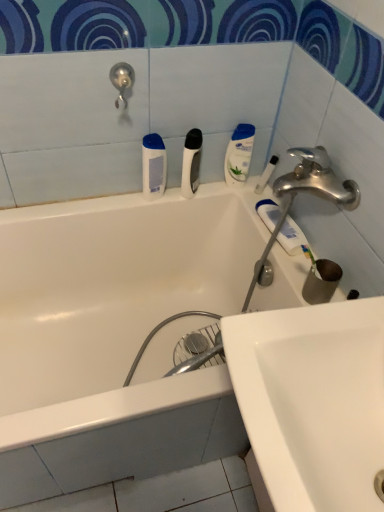
In order to click on vacant point to the left of clear plastic toothbrush at upper right, marked as the fourth toiletry in a left-to-right arrangement in this screenshot , I will do `click(230, 190)`.